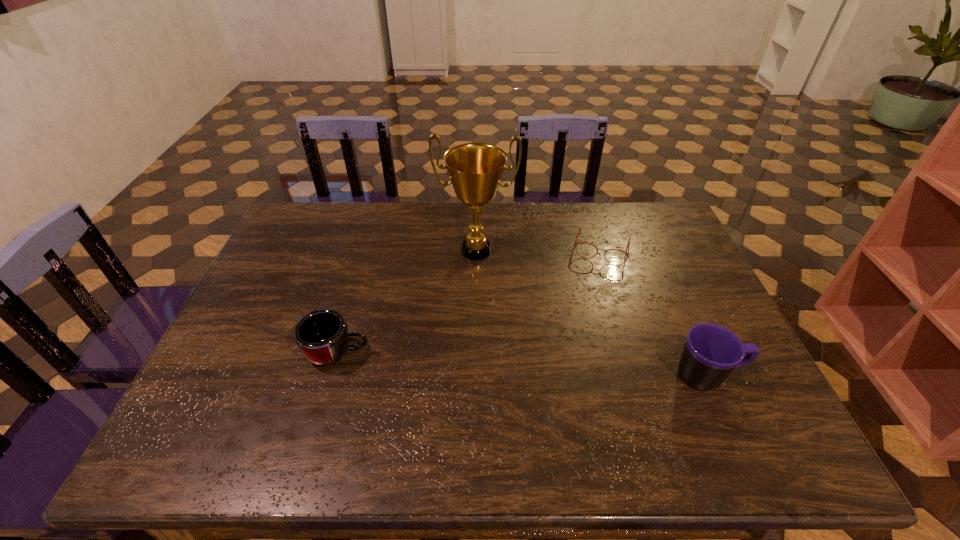
Where is `vacant space situated on the face of the spectacles`? vacant space situated on the face of the spectacles is located at coordinates [x=582, y=322].

Locate an element on the screen. This screenshot has height=540, width=960. vacant space located 0.060m on the front view with handles of the tallest object is located at coordinates (473, 282).

Identify the location of free space located on the front view with handles of the tallest object. (466, 363).

Locate an element on the screen. The width and height of the screenshot is (960, 540). free spot located on the front view with handles of the tallest object is located at coordinates (468, 332).

Where is `spectacles that is positioned at the far edge`? This screenshot has width=960, height=540. spectacles that is positioned at the far edge is located at coordinates (579, 228).

Where is `award located at the far edge`? The height and width of the screenshot is (540, 960). award located at the far edge is located at coordinates (475, 169).

You are a GUI agent. You are given a task and a screenshot of the screen. Output one action in this format:
    pyautogui.click(x=<x>, y=<y>)
    Task: Click on the object located at the near edge
    
    Given the screenshot: What is the action you would take?
    pyautogui.click(x=711, y=352)

Identify the location of object present at the right edge. (711, 352).

Locate an element on the screen. The height and width of the screenshot is (540, 960). object present at the near right corner is located at coordinates (711, 352).

Find the location of a particular element. The image size is (960, 540). free space at the far edge is located at coordinates (406, 207).